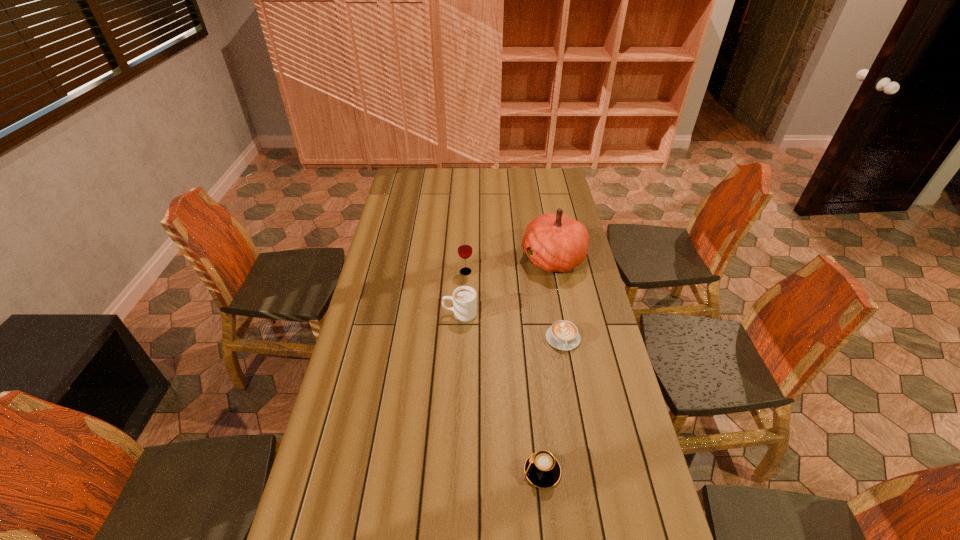
The width and height of the screenshot is (960, 540). Find the location of `the tallest object`. the tallest object is located at coordinates (557, 243).

The height and width of the screenshot is (540, 960). Identify the location of glass. (465, 250).

The image size is (960, 540). What are the coordinates of `the leftmost cappuccino` in the screenshot? It's located at (464, 298).

Identify the location of the farthest cappuccino. (464, 298).

Where is `the fourth tallest object`? Image resolution: width=960 pixels, height=540 pixels. the fourth tallest object is located at coordinates (542, 469).

At what (x,y) coordinates should I click in order to perform the action: click on the second tallest cappuccino. Please return your answer as a coordinate pair (x, y). This screenshot has width=960, height=540. Looking at the image, I should click on (542, 469).

Find the location of a particular element. Image resolution: width=960 pixels, height=540 pixels. the rightmost cappuccino is located at coordinates (563, 335).

I want to click on the second nearest object, so click(x=563, y=335).

At what (x,y) coordinates should I click in order to perform the action: click on vacant region located on the front-facing side of the tallest object. Please return your answer as a coordinate pair (x, y). This screenshot has width=960, height=540. Looking at the image, I should click on (475, 258).

The height and width of the screenshot is (540, 960). What are the coordinates of `vacant region located 0.270m on the front-facing side of the tallest object` in the screenshot? It's located at (457, 258).